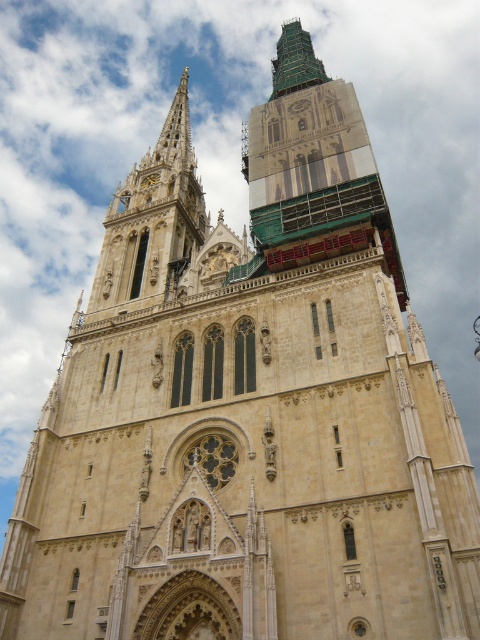
Question: Is green glass tower at upper center to the right of beige stone spire at upper left from the viewer's perspective?

Choices:
 (A) no
 (B) yes

Answer: (B)

Question: Among these objects, which one is nearest to the camera?

Choices:
 (A) green glass tower at upper center
 (B) beige stone spire at upper left

Answer: (A)

Question: Is green glass tower at upper center bigger than beige stone spire at upper left?

Choices:
 (A) yes
 (B) no

Answer: (B)

Question: Which object is farther from the camera taking this photo?

Choices:
 (A) green glass tower at upper center
 (B) beige stone spire at upper left

Answer: (B)

Question: Does green glass tower at upper center appear over beige stone spire at upper left?

Choices:
 (A) no
 (B) yes

Answer: (B)